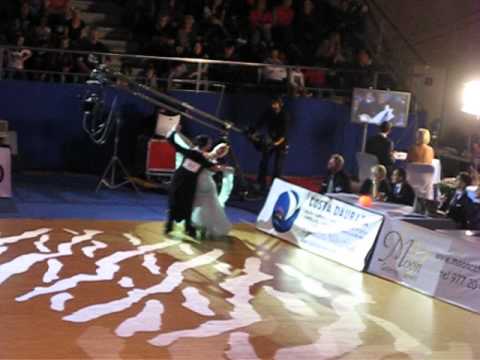
At what (x,y) coordinates should I click in order to perform the action: click on television. Please return your answer as a coordinate pair (x, y). This screenshot has width=480, height=360. Looking at the image, I should click on (390, 108).